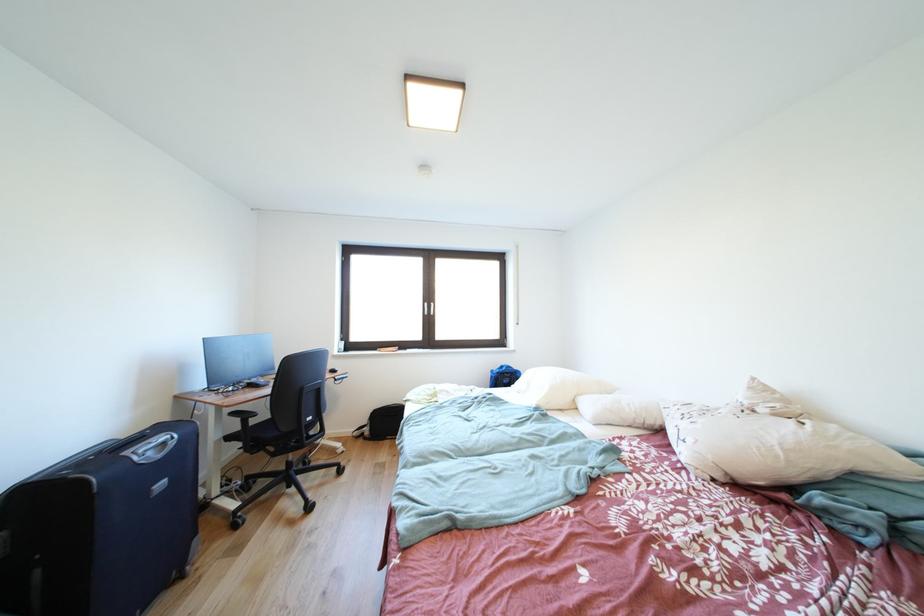
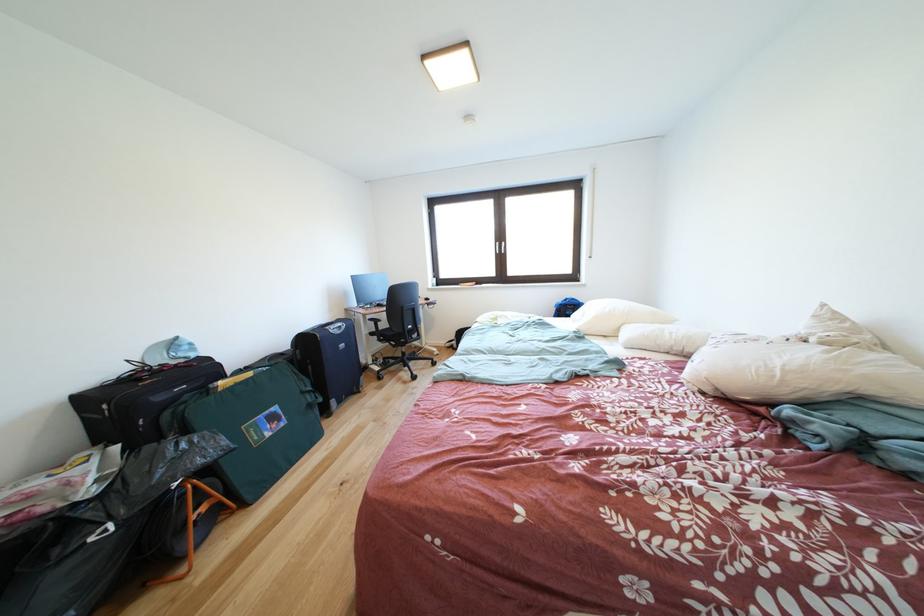
Find the pixel in the second image that matches [283,459] in the first image.

(403, 351)